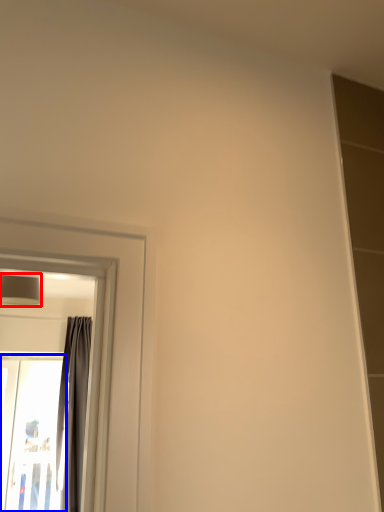
Question: Among these objects, which one is nearest to the camera, lamp (highlighted by a red box) or screen door (highlighted by a blue box)?

Choices:
 (A) lamp
 (B) screen door

Answer: (A)